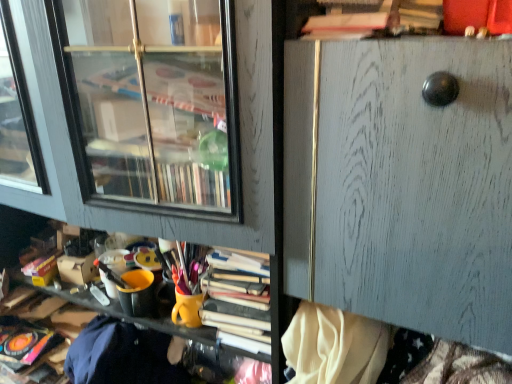
Question: Does wooden file cabinet at center appear on the right side of wooden shelf at center?

Choices:
 (A) yes
 (B) no

Answer: (A)

Question: Is wooden file cabinet at center taller than wooden shelf at center?

Choices:
 (A) yes
 (B) no

Answer: (B)

Question: Is wooden shelf at center surrounded by wooden file cabinet at center?

Choices:
 (A) yes
 (B) no

Answer: (B)

Question: Does wooden file cabinet at center lie in front of wooden shelf at center?

Choices:
 (A) yes
 (B) no

Answer: (A)

Question: Considering the relative sizes of wooden file cabinet at center and wooden shelf at center in the image provided, is wooden file cabinet at center bigger than wooden shelf at center?

Choices:
 (A) yes
 (B) no

Answer: (B)

Question: Is wooden file cabinet at center next to wooden shelf at center?

Choices:
 (A) yes
 (B) no

Answer: (B)

Question: Can you confirm if wooden shelf at center is positioned to the left of wooden file cabinet at center?

Choices:
 (A) no
 (B) yes

Answer: (B)

Question: Could wooden file cabinet at center be considered to be inside wooden shelf at center?

Choices:
 (A) yes
 (B) no

Answer: (B)

Question: Can you confirm if wooden shelf at center is bigger than wooden file cabinet at center?

Choices:
 (A) no
 (B) yes

Answer: (B)

Question: Is wooden shelf at center further to the viewer compared to wooden file cabinet at center?

Choices:
 (A) yes
 (B) no

Answer: (A)

Question: Is wooden shelf at center smaller than wooden file cabinet at center?

Choices:
 (A) yes
 (B) no

Answer: (B)

Question: Considering the relative positions of wooden shelf at center and wooden file cabinet at center in the image provided, is wooden shelf at center in front of wooden file cabinet at center?

Choices:
 (A) yes
 (B) no

Answer: (B)

Question: From a real-world perspective, is wooden shelf at center above or below wooden file cabinet at center?

Choices:
 (A) above
 (B) below

Answer: (B)